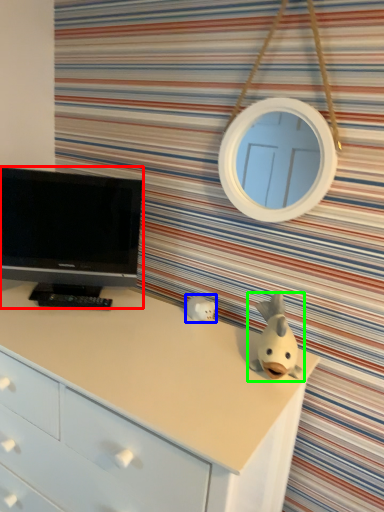
Question: Which object is the closest to the television (highlighted by a red box)? Choose among these: toy (highlighted by a blue box) or toy (highlighted by a green box).

Choices:
 (A) toy
 (B) toy

Answer: (A)